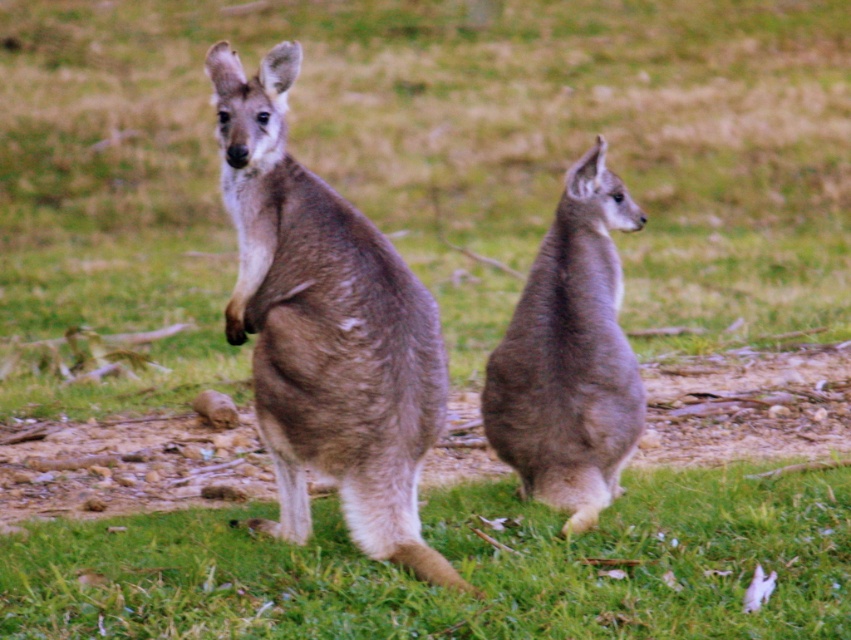
Is brown fur kangaroo at center to the left of gray fur kangaroo at center from the viewer's perspective?

Correct, you'll find brown fur kangaroo at center to the left of gray fur kangaroo at center.

Who is more distant from viewer, (x=323, y=342) or (x=581, y=385)?

Point (x=581, y=385)

This screenshot has width=851, height=640. In order to click on brown fur kangaroo at center in this screenshot , I will do `click(326, 330)`.

Is point (500, 630) closer to viewer compared to point (292, 496)?

Yes, point (500, 630) is closer to viewer.

Which is in front, point (697, 576) or point (307, 275)?

Positioned in front is point (307, 275).

Is point (718, 609) positioned in front of point (290, 321)?

Yes.

Identify the location of green soft grass at lower center. The image size is (851, 640). (455, 566).

Who is shorter, green soft grass at lower center or gray fur kangaroo at center?

green soft grass at lower center

Can you confirm if green soft grass at lower center is positioned above gray fur kangaroo at center?

Incorrect, green soft grass at lower center is not positioned above gray fur kangaroo at center.

Locate an element on the screen. green soft grass at lower center is located at coordinates (455, 566).

Where is `green soft grass at lower center`? green soft grass at lower center is located at coordinates (455, 566).